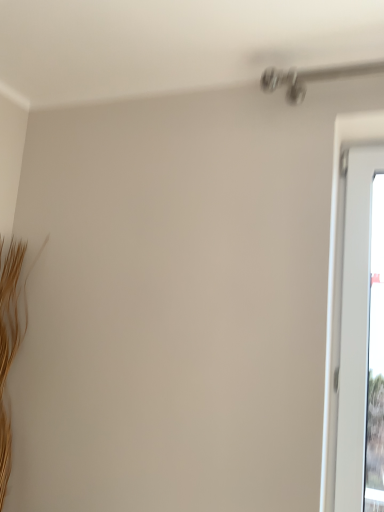
Image resolution: width=384 pixels, height=512 pixels. What do you see at coordinates (10, 341) in the screenshot? I see `brown textured twig at left` at bounding box center [10, 341].

Measure the distance between brown textured twig at left and camera.

The depth of brown textured twig at left is 1.47 meters.

The image size is (384, 512). In order to click on brown textured twig at left in this screenshot , I will do `click(10, 341)`.

What do you see at coordinates (375, 358) in the screenshot? The width and height of the screenshot is (384, 512). I see `transparent glass window at right` at bounding box center [375, 358].

Locate an element on the screen. This screenshot has width=384, height=512. transparent glass window at right is located at coordinates (375, 358).

What are the coordinates of `brown textured twig at left` in the screenshot? It's located at (10, 341).

Which is more to the left, transparent glass window at right or brown textured twig at left?

From the viewer's perspective, brown textured twig at left appears more on the left side.

Which object is closer to the camera, transparent glass window at right or brown textured twig at left?

transparent glass window at right is more forward.

Is point (375, 386) behind point (12, 316)?

Yes.

From the image's perspective, which one is positioned lower, transparent glass window at right or brown textured twig at left?

brown textured twig at left.

From a real-world perspective, between transparent glass window at right and brown textured twig at left, who is vertically higher?

transparent glass window at right, from a real-world perspective.

In terms of width, does transparent glass window at right look wider or thinner when compared to brown textured twig at left?

In the image, transparent glass window at right appears to be more narrow than brown textured twig at left.

Can you confirm if transparent glass window at right is shorter than brown textured twig at left?

No, transparent glass window at right is not shorter than brown textured twig at left.

Consider the image. Is transparent glass window at right bigger than brown textured twig at left?

No.

Would you say transparent glass window at right is inside or outside brown textured twig at left?

transparent glass window at right is outside brown textured twig at left.

Looking at this image, is transparent glass window at right far from brown textured twig at left?

Yes.

In the scene shown: Is transparent glass window at right turned away from brown textured twig at left?

transparent glass window at right does not have its back to brown textured twig at left.

How many degrees apart are the facing directions of transparent glass window at right and brown textured twig at left?

92.3 degrees separate the facing orientations of transparent glass window at right and brown textured twig at left.

Locate an element on the screen. window screen above the brown textured twig at left (from the image's perspective) is located at coordinates (375, 358).

Is brown textured twig at left at the right side of transparent glass window at right?

No.

Considering their positions, is brown textured twig at left located in front of or behind transparent glass window at right?

Clearly, brown textured twig at left is behind transparent glass window at right.

Is point (23, 243) closer to viewer compared to point (381, 272)?

No, (23, 243) is further to viewer.

From the image's perspective, which object appears higher, brown textured twig at left or transparent glass window at right?

transparent glass window at right.

From a real-world perspective, who is located lower, brown textured twig at left or transparent glass window at right?

brown textured twig at left, from a real-world perspective.

In terms of width, does brown textured twig at left look wider or thinner when compared to transparent glass window at right?

brown textured twig at left is wider than transparent glass window at right.

Considering the sizes of objects brown textured twig at left and transparent glass window at right in the image provided, who is taller, brown textured twig at left or transparent glass window at right?

transparent glass window at right.

Looking at the image, does brown textured twig at left seem bigger or smaller compared to transparent glass window at right?

Clearly, brown textured twig at left is larger in size than transparent glass window at right.

Is brown textured twig at left positioned beyond the bounds of transparent glass window at right?

Indeed, brown textured twig at left is completely outside transparent glass window at right.

Is the surface of brown textured twig at left in direct contact with transparent glass window at right?

No, brown textured twig at left is not with transparent glass window at right.

Is brown textured twig at left oriented away from transparent glass window at right?

That's not correct — brown textured twig at left is not looking away from transparent glass window at right.

This screenshot has height=512, width=384. In order to click on twig on the left of the transparent glass window at right in this screenshot , I will do `click(10, 341)`.

This screenshot has height=512, width=384. Identify the location of twig below the transparent glass window at right (from a real-world perspective). (10, 341).

Where is `window screen to the right of brown textured twig at left`? window screen to the right of brown textured twig at left is located at coordinates (375, 358).